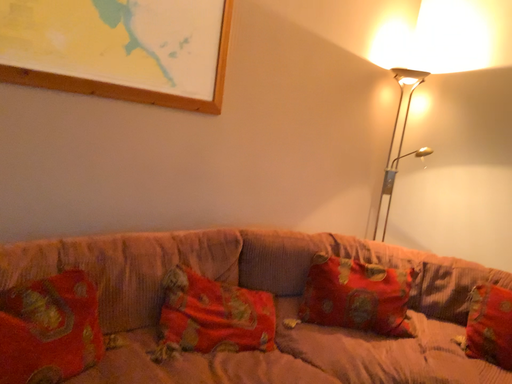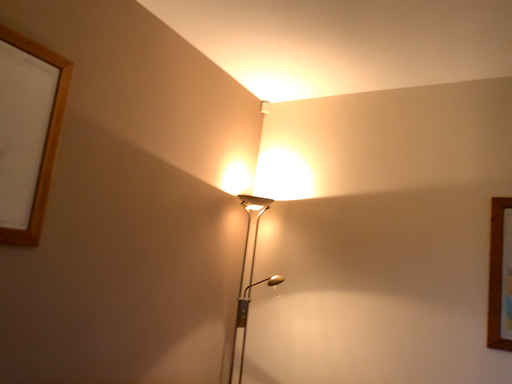
Question: How did the camera likely rotate when shooting the video?

Choices:
 (A) rotated left
 (B) rotated right

Answer: (B)